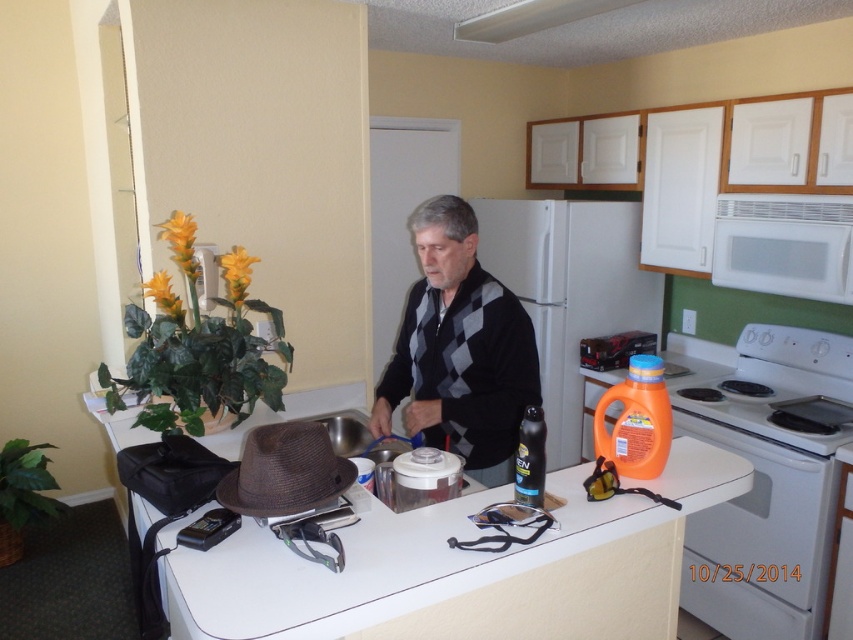
Can you confirm if orange plastic detergent at center is bigger than white glossy stove at right?

Correct, orange plastic detergent at center is larger in size than white glossy stove at right.

From the picture: Does orange plastic detergent at center have a smaller size compared to white glossy stove at right?

No.

Find the location of a particular element. Image resolution: width=853 pixels, height=640 pixels. orange plastic detergent at center is located at coordinates (567, 291).

Locate an element on the screen. Image resolution: width=853 pixels, height=640 pixels. orange plastic detergent at center is located at coordinates (567, 291).

Locate an element on the screen. The width and height of the screenshot is (853, 640). white matte microwave at upper right is located at coordinates (784, 244).

Does white matte microwave at upper right have a greater height compared to matte black spray can at center?

Correct, white matte microwave at upper right is much taller as matte black spray can at center.

What do you see at coordinates (784, 244) in the screenshot? The height and width of the screenshot is (640, 853). I see `white matte microwave at upper right` at bounding box center [784, 244].

Locate an element on the screen. The width and height of the screenshot is (853, 640). white matte microwave at upper right is located at coordinates (784, 244).

Does orange plastic detergent at center have a lesser width compared to brown straw hat at center?

In fact, orange plastic detergent at center might be wider than brown straw hat at center.

Is point (572, 406) positioned behind point (283, 513)?

That is True.

Is point (573, 410) farther from camera compared to point (271, 509)?

Yes, point (573, 410) is farther from viewer.

Find the location of a particular element. The width and height of the screenshot is (853, 640). orange plastic detergent at center is located at coordinates (567, 291).